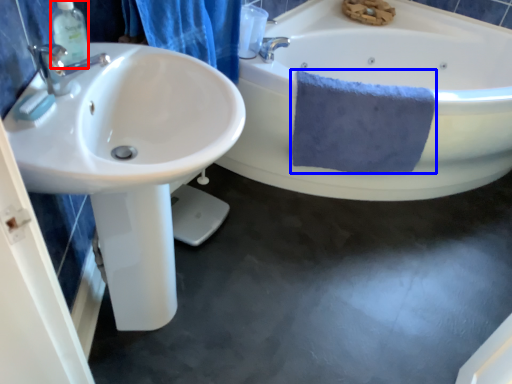
Question: Which object is closer to the camera taking this photo, soap dispenser (highlighted by a red box) or bath towel (highlighted by a blue box)?

Choices:
 (A) soap dispenser
 (B) bath towel

Answer: (A)